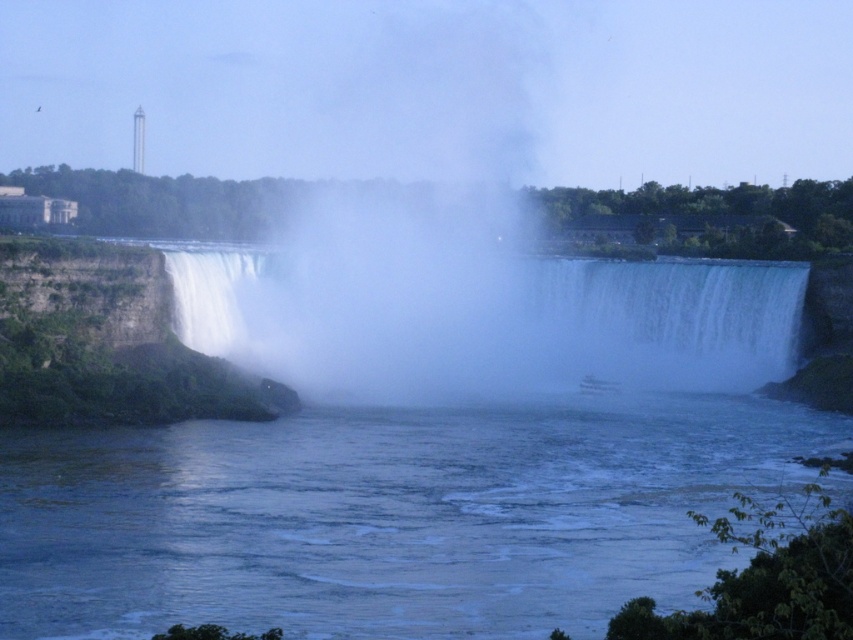
Question: Which point appears closest to the camera in this image?

Choices:
 (A) (587, 566)
 (B) (498, 321)
 (C) (579, 48)

Answer: (A)

Question: Which object is closer to the camera taking this photo?

Choices:
 (A) white misty waterfall at center
 (B) white mist at center
 (C) clear water at center

Answer: (C)

Question: Among these points, which one is nearest to the camera?

Choices:
 (A) (497, 128)
 (B) (672, 262)

Answer: (B)

Question: Is white mist at center to the right of white misty waterfall at center from the viewer's perspective?

Choices:
 (A) yes
 (B) no

Answer: (B)

Question: Can you confirm if clear water at center is positioned below white misty waterfall at center?

Choices:
 (A) yes
 (B) no

Answer: (A)

Question: Is clear water at center wider than white mist at center?

Choices:
 (A) yes
 (B) no

Answer: (B)